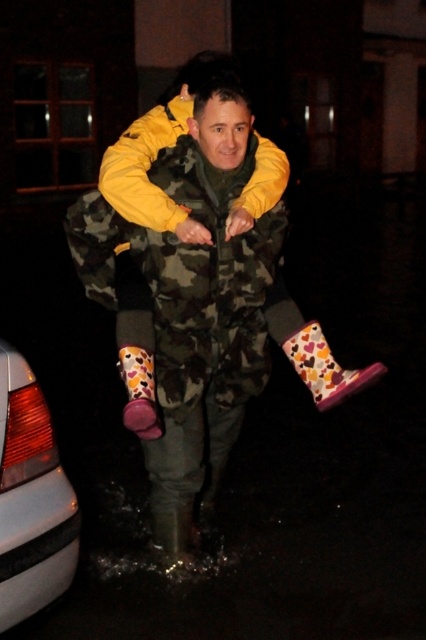
Is the position of white glossy car at lower left more distant than that of multicolored rubber boot at lower center?

No, white glossy car at lower left is closer to the viewer.

Is point (20, 472) positioned in front of point (299, 339)?

That is True.

Does point (48, 582) come in front of point (350, 384)?

Yes, point (48, 582) is in front of point (350, 384).

You are a GUI agent. You are given a task and a screenshot of the screen. Output one action in this format:
    pyautogui.click(x=<x>, y=<y>)
    Task: Click on the white glossy car at lower left
    This screenshot has width=426, height=640.
    Given the screenshot: What is the action you would take?
    pyautogui.click(x=31, y=499)

Between point (29, 609) and point (129, 381), which one is positioned in front?

Point (29, 609) is more forward.

Based on the photo, measure the distance between point (17, 497) and camera.

Point (17, 497) and camera are 2.52 meters apart.

The height and width of the screenshot is (640, 426). Find the location of `white glossy car at lower left`. white glossy car at lower left is located at coordinates (31, 499).

This screenshot has width=426, height=640. Identify the location of white glossy car at lower left. (31, 499).

Does multicolored rubber boot at lower center appear on the right side of floral rubber boot at lower center?

Correct, you'll find multicolored rubber boot at lower center to the right of floral rubber boot at lower center.

Is multicolored rubber boot at lower center bigger than floral rubber boot at lower center?

Indeed, multicolored rubber boot at lower center has a larger size compared to floral rubber boot at lower center.

You are a GUI agent. You are given a task and a screenshot of the screen. Output one action in this format:
    pyautogui.click(x=<x>, y=<y>)
    Task: Click on the multicolored rubber boot at lower center
    The width and height of the screenshot is (426, 640).
    Given the screenshot: What is the action you would take?
    tap(325, 368)